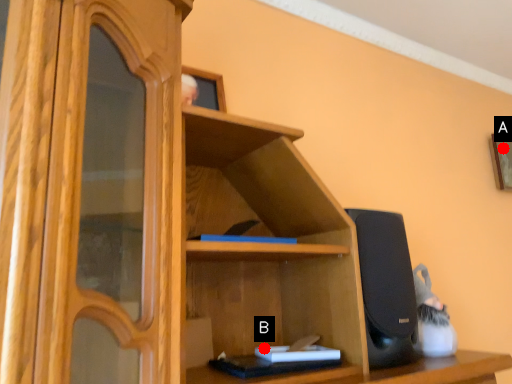
Question: Two points are circled on the image, labeled by A and B beside each circle. Which point is closer to the camera?

Choices:
 (A) A is closer
 (B) B is closer

Answer: (B)